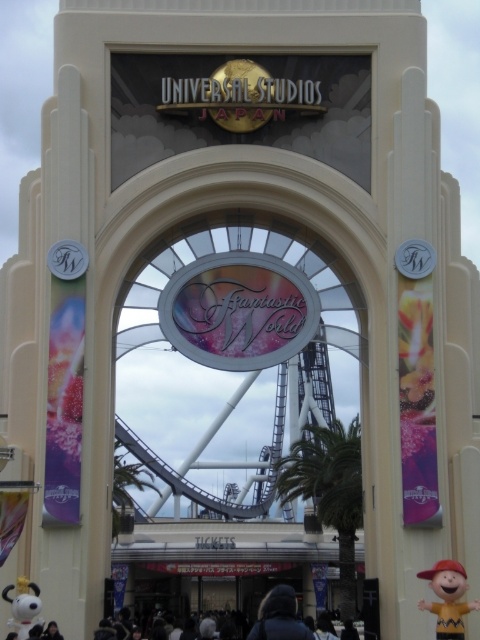
Is green leafy palm tree at center wider than white matte snoopy at lower left?

Correct, the width of green leafy palm tree at center exceeds that of white matte snoopy at lower left.

The image size is (480, 640). In order to click on green leafy palm tree at center in this screenshot , I will do `click(330, 490)`.

Identify the location of green leafy palm tree at center. (330, 490).

Which is below, yellow matte doll at lower right or dark blue jacket at center?

Positioned lower is dark blue jacket at center.

Between point (456, 598) and point (280, 621), which one is positioned behind?

The point (280, 621) is more distant.

Identify the location of yellow matte doll at lower right. (447, 596).

Where is `green leafy palm tree at center`? Image resolution: width=480 pixels, height=640 pixels. green leafy palm tree at center is located at coordinates (330, 490).

Does point (321, 502) come closer to viewer compared to point (291, 612)?

No.

This screenshot has width=480, height=640. Find the location of `green leafy palm tree at center`. green leafy palm tree at center is located at coordinates 330,490.

Locate an element on the screen. green leafy palm tree at center is located at coordinates (330, 490).